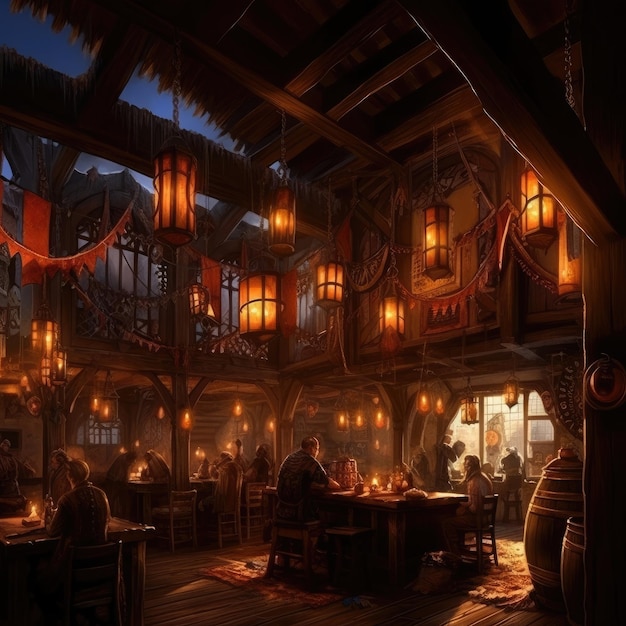
Locate an element on the screen. table is located at coordinates (443, 493).